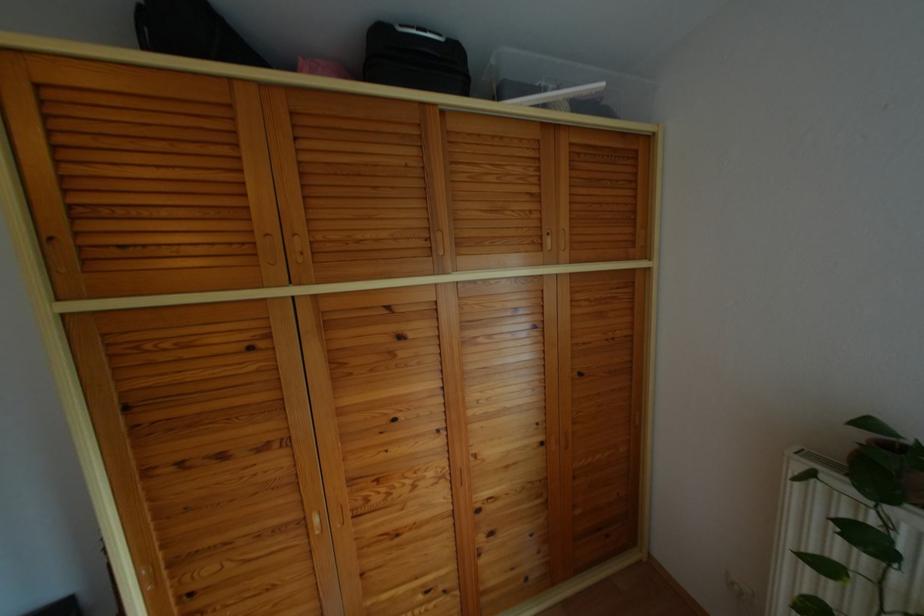
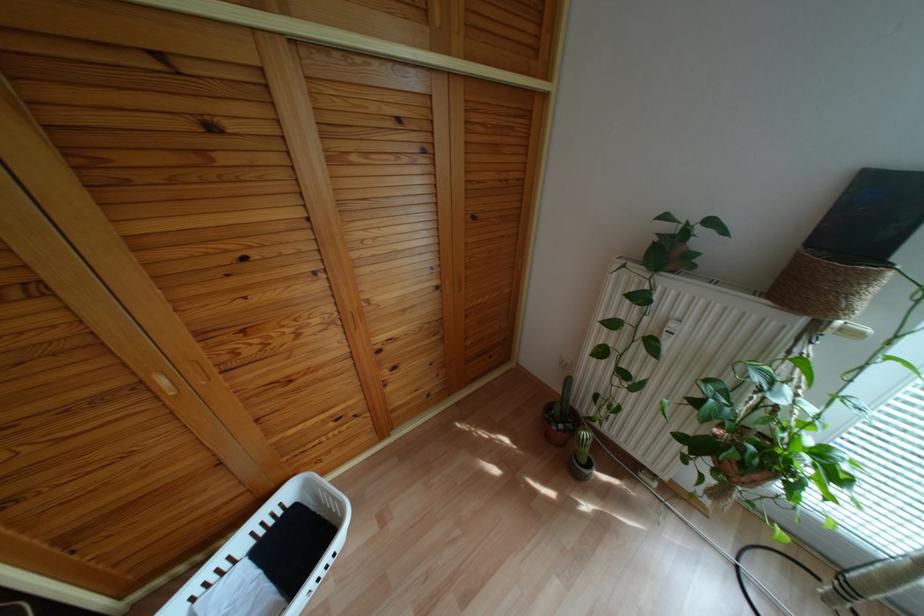
In the second image, find the point that corresponds to [315,520] in the first image.

(163, 382)